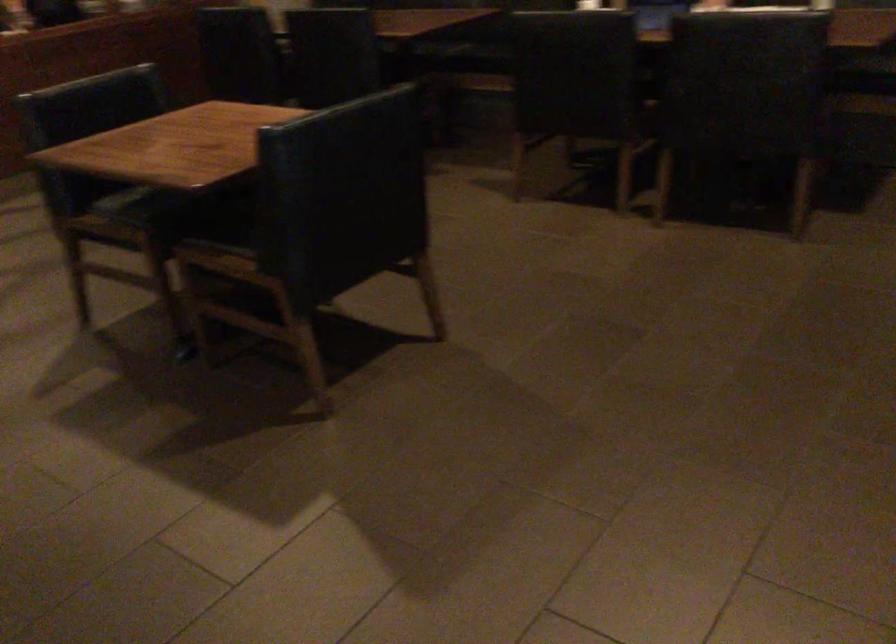
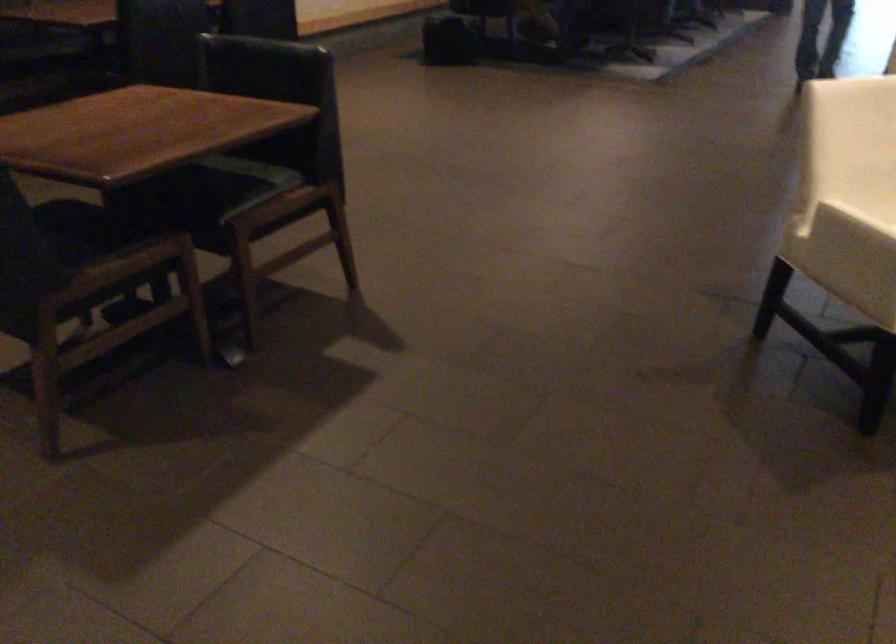
How did the camera likely rotate?

The camera's rotation is toward right-down.